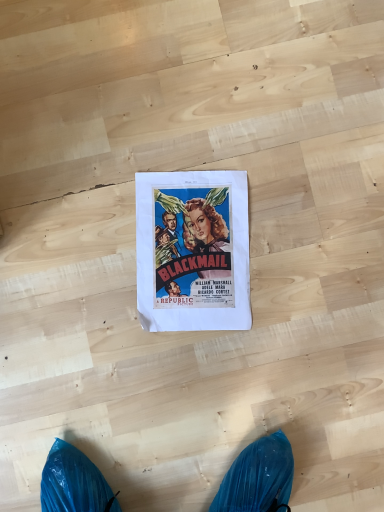
The width and height of the screenshot is (384, 512). I want to click on vacant space in front of matte paper poster at center, so click(202, 377).